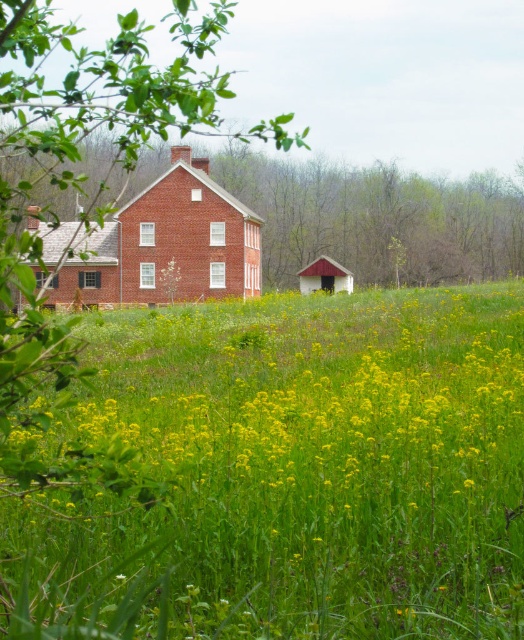
You are standing in the middle of the green grassy field at center and want to reach the brick house at center. Which direction should you head towards?

Since the green grassy field at center is to the right of the brick house at center, you should head towards the left to reach the brick house at center.

You are a drone operator planning to fly a drone over the green grassy field at center and the brick house at center. Which object is taller so that the drone needs to ascend higher to avoid collision?

The brick house at center is taller than the green grassy field at center, so the drone needs to ascend higher to avoid collision with the brick house at center.

You are planning to set up a picnic area in the green grassy field at center and the brick house at center. Which location has more space for setting up tents and chairs?

The brick house at center has more space because the green grassy field at center is thinner than the brick house at center, indicating it is narrower or smaller in size.